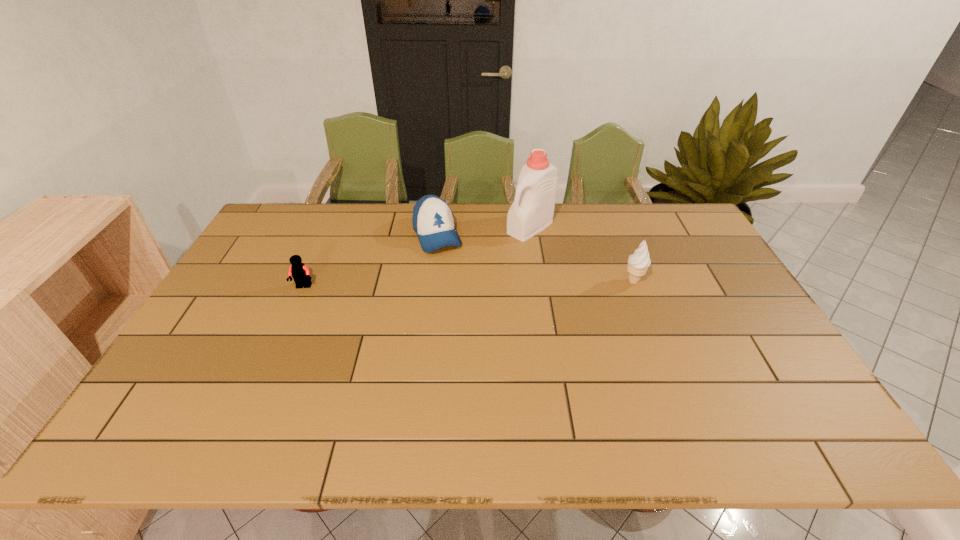
Find the location of a particular element. Lego is located at coordinates (300, 273).

Where is `icecream`? icecream is located at coordinates (638, 263).

Find the location of a particular element. This screenshot has width=960, height=540. the rightmost object is located at coordinates (638, 263).

Locate an element on the screen. The image size is (960, 540). the third object from left to right is located at coordinates (532, 211).

Where is `the tallest object`? the tallest object is located at coordinates (532, 211).

The width and height of the screenshot is (960, 540). I want to click on baseball cap, so click(x=433, y=221).

I want to click on free space located 0.070m on the front-facing side of the Lego, so [295, 309].

I want to click on free space located 0.100m on the front-facing side of the icecream, so click(589, 281).

Where is `free location located 0.260m on the front-facing side of the icecream`? Image resolution: width=960 pixels, height=540 pixels. free location located 0.260m on the front-facing side of the icecream is located at coordinates (537, 281).

Identify the location of blank space located 0.130m on the front-facing side of the icecream. The height and width of the screenshot is (540, 960). (580, 281).